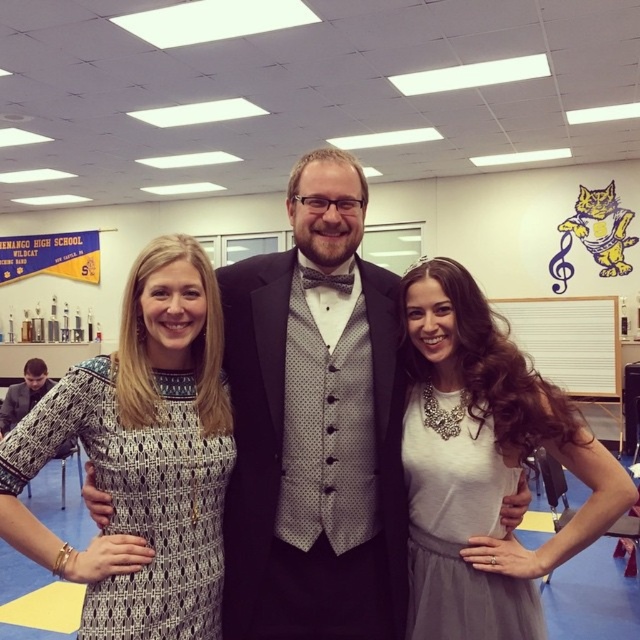
Question: Is black satin tuxedo at center bigger than gray tulle dress at center?

Choices:
 (A) no
 (B) yes

Answer: (B)

Question: Which object appears farthest from the camera in this image?

Choices:
 (A) gray tulle dress at center
 (B) white paper at upper right
 (C) printed fabric dress at center
 (D) black satin tuxedo at center

Answer: (B)

Question: Which point is farther to the camera?

Choices:
 (A) printed fabric dress at center
 (B) white paper at upper right
 (C) gray tulle dress at center

Answer: (B)

Question: Is black satin tuxedo at center above white paper at upper right?

Choices:
 (A) no
 (B) yes

Answer: (A)

Question: Which object appears closest to the camera in this image?

Choices:
 (A) white paper at upper right
 (B) black satin tuxedo at center

Answer: (B)

Question: Can you confirm if black satin tuxedo at center is wider than white fabric dress at center?

Choices:
 (A) no
 (B) yes

Answer: (A)